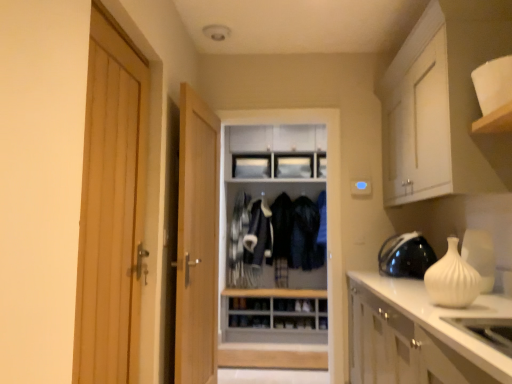
Question: Is light wood door at left, which is the 1th door from front to back, positioned with its back to black glossy helmet at right?

Choices:
 (A) no
 (B) yes

Answer: (A)

Question: Can you confirm if light wood door at left, marked as the 2th door in a back-to-front arrangement, is taller than black glossy helmet at right?

Choices:
 (A) no
 (B) yes

Answer: (B)

Question: Is light wood door at left, which ranks as the 2th door in right-to-left order, facing towards black glossy helmet at right?

Choices:
 (A) yes
 (B) no

Answer: (B)

Question: Can you see light wood door at left, which ranks as the 2th door in right-to-left order, touching black glossy helmet at right?

Choices:
 (A) no
 (B) yes

Answer: (A)

Question: Does light wood door at left, which ranks as the 2th door in right-to-left order, appear on the left side of black glossy helmet at right?

Choices:
 (A) no
 (B) yes

Answer: (B)

Question: In the image, is black glossy helmet at right on the left side or the right side of wooden dresser at center?

Choices:
 (A) right
 (B) left

Answer: (A)

Question: From their relative heights in the image, would you say black glossy helmet at right is taller or shorter than wooden dresser at center?

Choices:
 (A) short
 (B) tall

Answer: (A)

Question: Is black glossy helmet at right wider or thinner than wooden dresser at center?

Choices:
 (A) wide
 (B) thin

Answer: (B)

Question: Considering their positions, is black glossy helmet at right located in front of or behind wooden dresser at center?

Choices:
 (A) behind
 (B) front

Answer: (B)

Question: Is dark blue fabric jacket at center, the first clothing when ordered from right to left, in front of or behind light wood door at center, which ranks as the first door in back-to-front order, in the image?

Choices:
 (A) front
 (B) behind

Answer: (B)

Question: Is point (311, 205) positioned closer to the camera than point (200, 246)?

Choices:
 (A) closer
 (B) farther

Answer: (B)

Question: Considering the relative positions of dark blue fabric jacket at center, the first clothing when ordered from right to left, and light wood door at center, marked as the 2th door in a front-to-back arrangement, in the image provided, is dark blue fabric jacket at center, the first clothing when ordered from right to left, to the left or to the right of light wood door at center, marked as the 2th door in a front-to-back arrangement,?

Choices:
 (A) right
 (B) left

Answer: (A)

Question: In terms of width, does dark blue fabric jacket at center, acting as the second clothing starting from the left, look wider or thinner when compared to light wood door at center, which ranks as the first door in back-to-front order?

Choices:
 (A) wide
 (B) thin

Answer: (A)

Question: From a real-world perspective, is black glossy helmet at right positioned above or below light wood door at left, which ranks as the 2th door in right-to-left order?

Choices:
 (A) below
 (B) above

Answer: (A)

Question: From their relative heights in the image, would you say black glossy helmet at right is taller or shorter than light wood door at left, which is the 1th door from front to back?

Choices:
 (A) tall
 (B) short

Answer: (B)